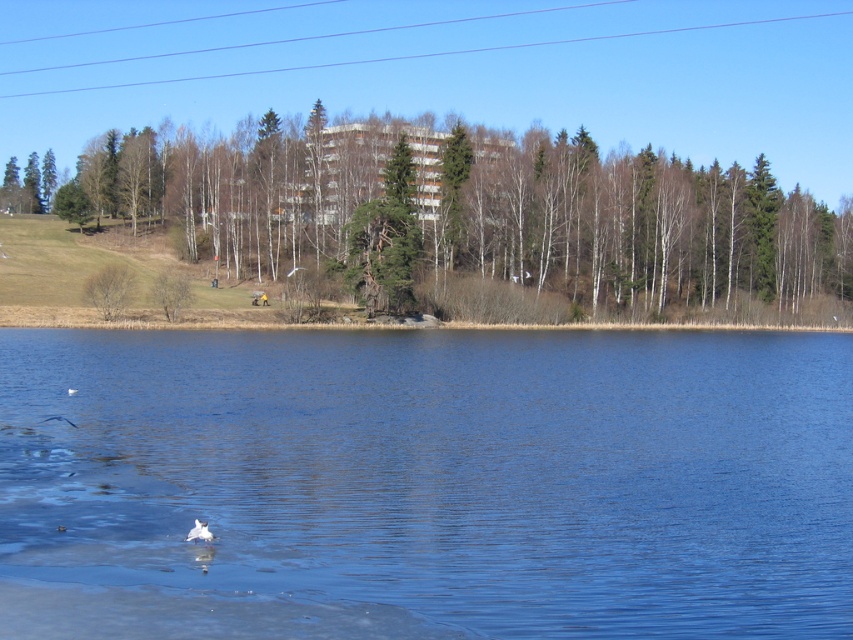
You are standing at the edge of the lake and want to reach the point labeled point (123,264). To do this, you must first pass through point (67,388). Is this path possible?

Yes, because point (123,264) is behind point (67,388), so you must pass through point (67,388) first to reach it.

You are standing at the lakeside and see the blue water at lower center and the white feathered bird at lower left. Which object is positioned higher in the scene?

The blue water at lower center is positioned higher than the white feathered bird at lower left.

You are standing at the point marked as point [109,289] in the image. What object is located exactly at this point?

The green matte tree at lower left is located exactly at point [109,289].